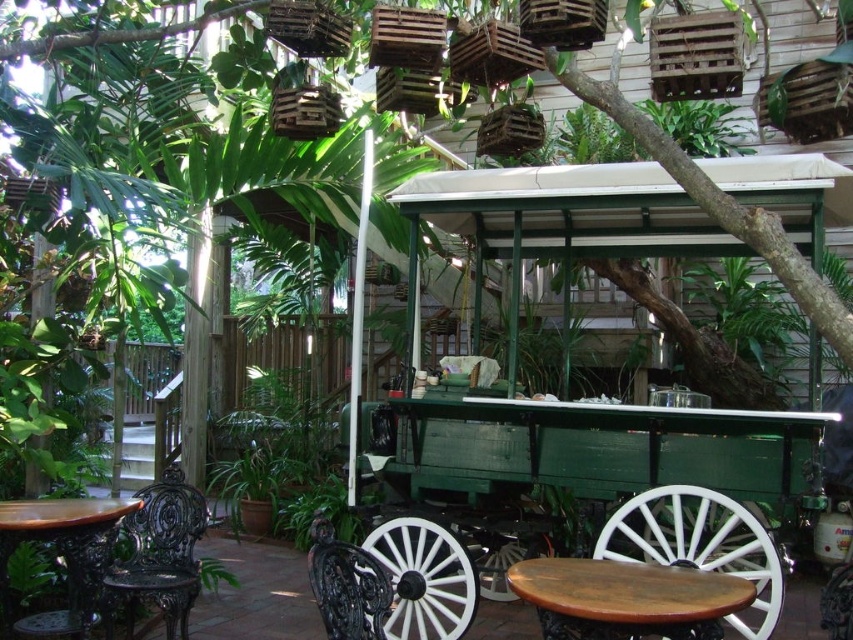
How far apart are wooden table at lower left and black wrought iron chair at lower center?

wooden table at lower left is 1.37 meters from black wrought iron chair at lower center.

Who is more forward, (13,532) or (315,520)?

Point (315,520) is in front.

At what (x,y) coordinates should I click in order to perform the action: click on wooden table at lower left. Please return your answer as a coordinate pair (x, y). Looking at the image, I should click on (62, 556).

Consider the image. Between wooden table at center and black wrought iron chair at lower left, which one appears on the right side from the viewer's perspective?

From the viewer's perspective, wooden table at center appears more on the right side.

What do you see at coordinates (625, 598) in the screenshot? I see `wooden table at center` at bounding box center [625, 598].

Describe the element at coordinates (625, 598) in the screenshot. I see `wooden table at center` at that location.

Where is `wooden table at center`? wooden table at center is located at coordinates (625, 598).

Who is lower down, black wrought iron chair at lower left or wooden table at lower left?

black wrought iron chair at lower left

Who is taller, black wrought iron chair at lower left or wooden table at lower left?

black wrought iron chair at lower left

Where is `black wrought iron chair at lower left`? black wrought iron chair at lower left is located at coordinates pyautogui.click(x=158, y=556).

The height and width of the screenshot is (640, 853). I want to click on black wrought iron chair at lower left, so click(x=158, y=556).